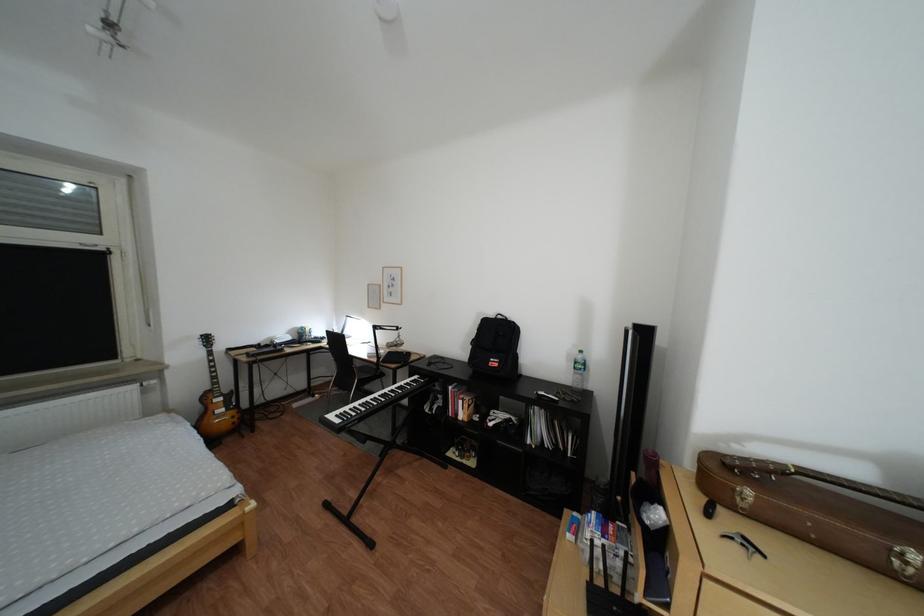
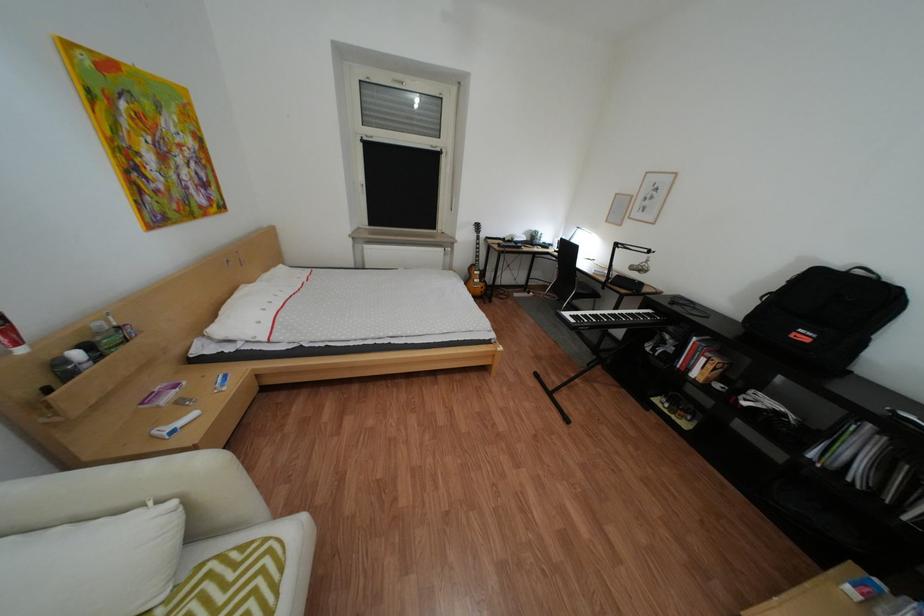
The images are taken continuously from a first-person perspective. In which direction is your viewpoint rotating?

The camera's rotation is toward left-down.